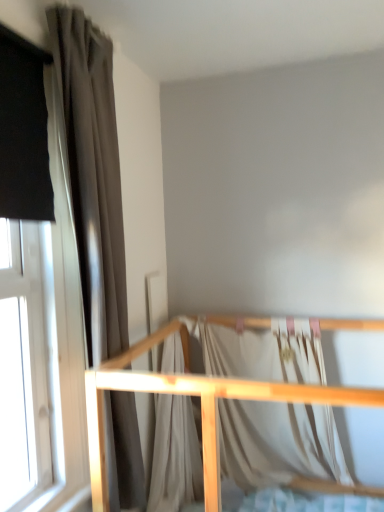
Locate an element on the screen. The image size is (384, 512). silky white fabric at center is located at coordinates (278, 443).

The image size is (384, 512). What do you see at coordinates (201, 406) in the screenshot?
I see `light wood crib rail at lower center` at bounding box center [201, 406].

This screenshot has width=384, height=512. I want to click on silky white fabric at center, so click(x=278, y=443).

Considering the sizes of objects matte gray curtain at left and silky white fabric at center in the image provided, who is smaller, matte gray curtain at left or silky white fabric at center?

silky white fabric at center is smaller.

In the image, there is a silky white fabric at center. Identify the location of curtain above it (from the image's perspective). [x=93, y=175].

How different are the orientations of matte gray curtain at left and silky white fabric at center in degrees?

88.8 degrees.

From a real-world perspective, who is located lower, matte gray curtain at left or silky white fabric at center?

Result: silky white fabric at center.

From the picture: Is matte gray curtain at left closer to camera compared to light wood crib rail at lower center?

No.

Is matte gray curtain at left oriented towards light wood crib rail at lower center?

No, matte gray curtain at left is not facing towards light wood crib rail at lower center.

From the image's perspective, between matte gray curtain at left and light wood crib rail at lower center, who is located below?

light wood crib rail at lower center, from the image's perspective.

Is matte gray curtain at left completely or partially inside light wood crib rail at lower center?

Actually, matte gray curtain at left is outside light wood crib rail at lower center.

From a real-world perspective, does light wood crib rail at lower center sit lower than matte gray curtain at left?

Correct, in the physical world, light wood crib rail at lower center is lower than matte gray curtain at left.

Considering the relative positions of light wood crib rail at lower center and matte gray curtain at left in the image provided, is light wood crib rail at lower center behind matte gray curtain at left?

No, light wood crib rail at lower center is closer to the camera.

Considering the sizes of light wood crib rail at lower center and matte gray curtain at left in the image, is light wood crib rail at lower center taller or shorter than matte gray curtain at left?

Clearly, light wood crib rail at lower center is shorter compared to matte gray curtain at left.

Could you tell me if light wood crib rail at lower center is facing silky white fabric at center?

Yes.

Considering the positions of objects light wood crib rail at lower center and silky white fabric at center in the image provided, who is in front, light wood crib rail at lower center or silky white fabric at center?

light wood crib rail at lower center is in front.

From a real-world perspective, is light wood crib rail at lower center below silky white fabric at center?

Yes, from a real-world perspective, light wood crib rail at lower center is below silky white fabric at center.

Does point (345, 397) come in front of point (236, 450)?

Yes, point (345, 397) is closer to viewer.

Can you confirm if silky white fabric at center is positioned to the left of light wood crib rail at lower center?

No.

Does silky white fabric at center have a greater width compared to light wood crib rail at lower center?

Incorrect, the width of silky white fabric at center does not surpass that of light wood crib rail at lower center.

Which of these two, silky white fabric at center or light wood crib rail at lower center, stands shorter?

silky white fabric at center is shorter.

From a real-world perspective, is silky white fabric at center beneath light wood crib rail at lower center?

Actually, silky white fabric at center is physically above light wood crib rail at lower center in the real world.

Is silky white fabric at center facing towards matte gray curtain at left?

No.

How different are the orientations of silky white fabric at center and matte gray curtain at left in degrees?

silky white fabric at center and matte gray curtain at left are facing 88.8 degrees away from each other.

Is silky white fabric at center not near matte gray curtain at left?

Actually, silky white fabric at center and matte gray curtain at left are a little close together.

Which is more to the right, silky white fabric at center or matte gray curtain at left?

silky white fabric at center is more to the right.

Identify the location of blanket behind the matte gray curtain at left. (278, 443).

Where is `rail beneath the matte gray curtain at left (from a real-world perspective)`? rail beneath the matte gray curtain at left (from a real-world perspective) is located at coordinates (201, 406).

Looking at the image, which one is located closer to silky white fabric at center, light wood crib rail at lower center or matte gray curtain at left?

Among the two, light wood crib rail at lower center is located nearer to silky white fabric at center.

When comparing their distances from light wood crib rail at lower center, does matte gray curtain at left or silky white fabric at center seem closer?

The object closer to light wood crib rail at lower center is matte gray curtain at left.

Which object lies further to the anchor point light wood crib rail at lower center, silky white fabric at center or matte gray curtain at left?

The object further to light wood crib rail at lower center is silky white fabric at center.

Estimate the real-world distances between objects in this image. Which object is further from matte gray curtain at left, light wood crib rail at lower center or silky white fabric at center?

silky white fabric at center is positioned further to the anchor matte gray curtain at left.

Considering their positions, is silky white fabric at center positioned closer to matte gray curtain at left than light wood crib rail at lower center?

Based on the image, light wood crib rail at lower center appears to be nearer to matte gray curtain at left.

Estimate the real-world distances between objects in this image. Which object is further from silky white fabric at center, matte gray curtain at left or light wood crib rail at lower center?

The object further to silky white fabric at center is matte gray curtain at left.

Find the location of a particular element. This screenshot has height=512, width=384. curtain located between light wood crib rail at lower center and silky white fabric at center in the depth direction is located at coordinates coord(93,175).